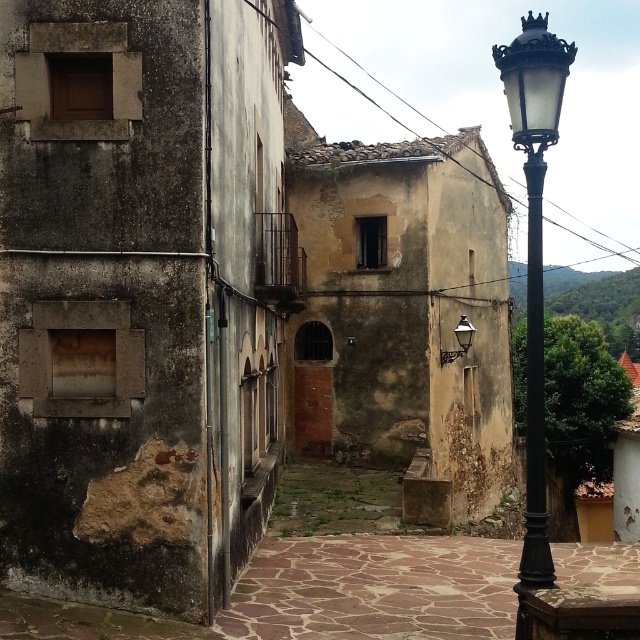
Question: Observing the image, what is the correct spatial positioning of black metal street light at upper right in reference to matte black lamp at upper right?

Choices:
 (A) above
 (B) below

Answer: (A)

Question: Does black metal street light at upper right appear over matte black lamp at upper right?

Choices:
 (A) yes
 (B) no

Answer: (A)

Question: Which point is farther to the camera?

Choices:
 (A) black metal street light at upper right
 (B) matte black lamp at upper right

Answer: (B)

Question: Observing the image, what is the correct spatial positioning of black metal street light at upper right in reference to matte black lamp at upper right?

Choices:
 (A) right
 (B) left

Answer: (A)

Question: Which of the following is the farthest from the observer?

Choices:
 (A) black metal street light at upper right
 (B) matte black lamp at upper right

Answer: (B)